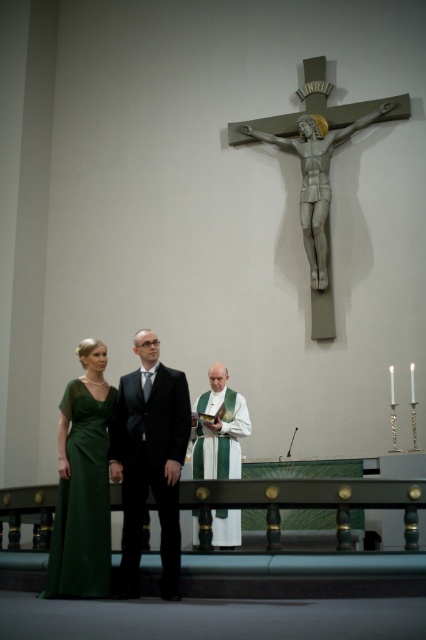
You are standing at the point marked by the coordinates point [123,481] in a church. You want to move to the crucifix mounted on the wall above the green altar. Can you walk straight ahead from your current position to reach the crucifix without any obstacles?

The distance between point [123,481] and the viewer is 5.22 meters. Since there are no obstacles mentioned in the scene description, you can walk straight ahead from point [123,481] to reach the crucifix mounted on the wall above the green altar.